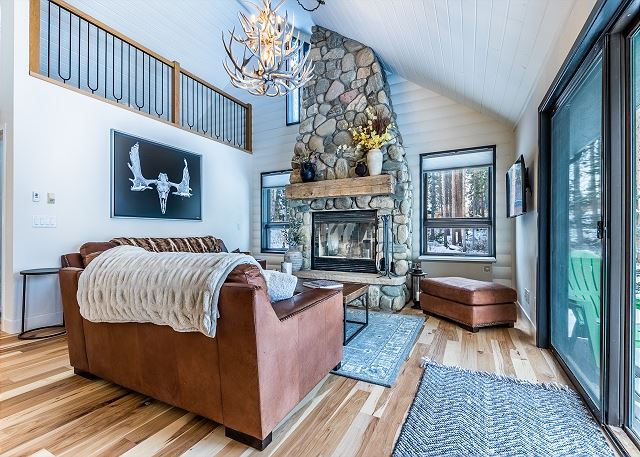
The width and height of the screenshot is (640, 457). Identify the location of brown couch. (297, 340), (198, 348), (105, 339).